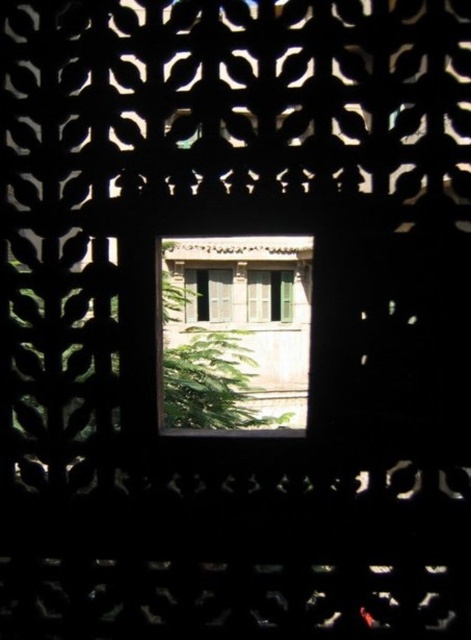
You are standing in a room with a wooden window at center and a green matte door at center. You want to hang a large painting that requires a 1.2 meter wide space. Which object can accommodate the painting?

The wooden window at center is larger in size than the green matte door at center, so the wooden window at center can accommodate the painting as it has enough space.

You are an architect designing a new building. You want to install a green matte window at center and a green matte door at center. Which one should be larger to match the existing design shown in the scene?

The green matte window at center should be larger than the green matte door at center to match the existing design shown in the scene.